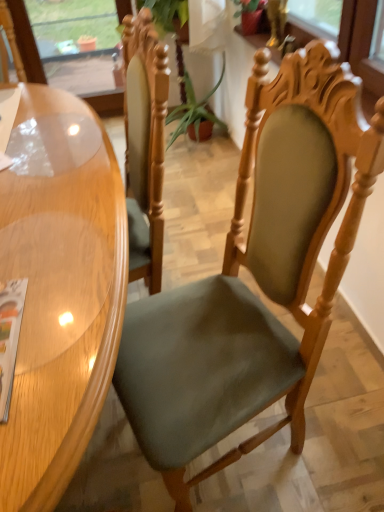
This screenshot has height=512, width=384. I want to click on free space to the right of matte paper magazine at lower left, so click(66, 341).